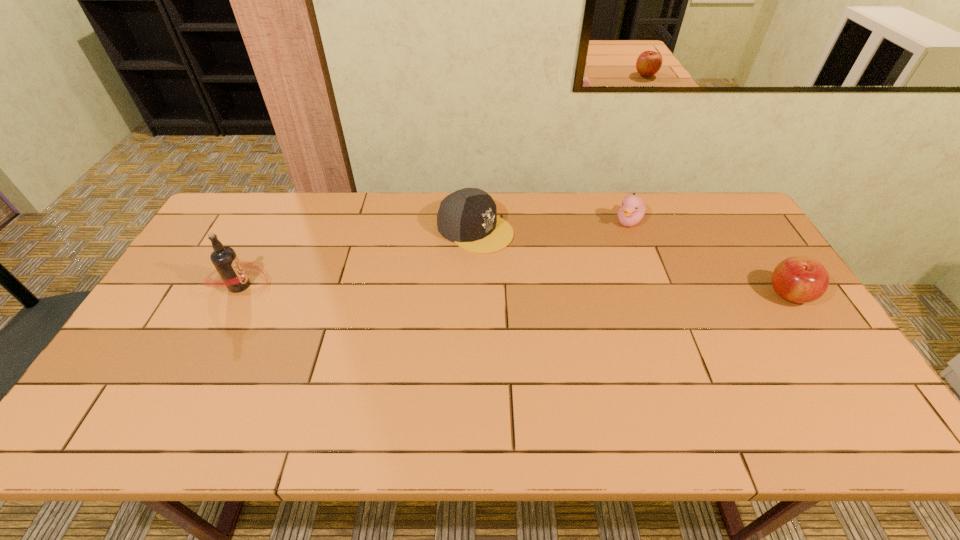
Find the location of a particular element. The width and height of the screenshot is (960, 540). free space between the second object from left to right and the third object from left to right is located at coordinates (552, 225).

Image resolution: width=960 pixels, height=540 pixels. In order to click on vacant space that is in between the root beer and the apple in this screenshot , I will do `click(515, 290)`.

Locate an element on the screen. This screenshot has height=540, width=960. free spot between the cap and the root beer is located at coordinates (358, 258).

Find the location of a particular element. The height and width of the screenshot is (540, 960). vacant point located between the leftmost object and the second object from left to right is located at coordinates (358, 258).

The image size is (960, 540). In order to click on unoccupied position between the rightmost object and the tallest object in this screenshot , I will do `click(515, 290)`.

Where is `vacant area that lies between the cap and the third object from left to right`? The width and height of the screenshot is (960, 540). vacant area that lies between the cap and the third object from left to right is located at coordinates (552, 225).

Locate which object is the third closest to the apple. Please provide its 2D coordinates. Your answer should be formatted as a tuple, i.e. [(x, y)], where the tuple contains the x and y coordinates of a point satisfying the conditions above.

[(230, 268)]

You are a GUI agent. You are given a task and a screenshot of the screen. Output one action in this format:
    pyautogui.click(x=<x>, y=<y>)
    Task: Click on the closest object to the second object from left to right
    This screenshot has width=960, height=540.
    Given the screenshot: What is the action you would take?
    pyautogui.click(x=633, y=208)

At what (x,y) coordinates should I click in order to perform the action: click on blank space that satisfies the following two spatial constraints: 1. on the back side of the third object from right to left; 2. on the left side of the third object from left to right. Please return your answer as a coordinate pair (x, y). The width and height of the screenshot is (960, 540). Looking at the image, I should click on (475, 221).

Where is `vacant space that satisfies the following two spatial constraints: 1. on the back side of the cap; 2. on the right side of the third object from left to right`? vacant space that satisfies the following two spatial constraints: 1. on the back side of the cap; 2. on the right side of the third object from left to right is located at coordinates (475, 221).